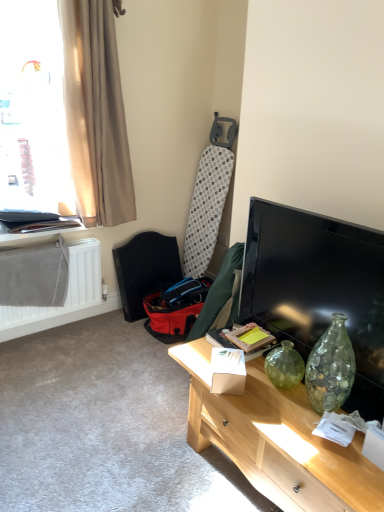
Question: Considering the relative sizes of matte black tv at right and matte black folder at upper left in the image provided, is matte black tv at right wider than matte black folder at upper left?

Choices:
 (A) yes
 (B) no

Answer: (B)

Question: Can you confirm if matte black tv at right is shorter than matte black folder at upper left?

Choices:
 (A) yes
 (B) no

Answer: (B)

Question: From a real-world perspective, does matte black tv at right sit lower than matte black folder at upper left?

Choices:
 (A) yes
 (B) no

Answer: (B)

Question: Is matte black tv at right oriented towards matte black folder at upper left?

Choices:
 (A) no
 (B) yes

Answer: (A)

Question: Can you confirm if matte black tv at right is thinner than matte black folder at upper left?

Choices:
 (A) yes
 (B) no

Answer: (A)

Question: From the image's perspective, is matte black tv at right below matte black folder at upper left?

Choices:
 (A) yes
 (B) no

Answer: (A)

Question: From the image's perspective, is red fabric swivel chair at lower left under matte black tv at right?

Choices:
 (A) yes
 (B) no

Answer: (B)

Question: Is red fabric swivel chair at lower left taller than matte black tv at right?

Choices:
 (A) yes
 (B) no

Answer: (A)

Question: Considering the relative sizes of red fabric swivel chair at lower left and matte black tv at right in the image provided, is red fabric swivel chair at lower left wider than matte black tv at right?

Choices:
 (A) no
 (B) yes

Answer: (B)

Question: From a real-world perspective, is red fabric swivel chair at lower left on matte black tv at right?

Choices:
 (A) yes
 (B) no

Answer: (B)

Question: Is red fabric swivel chair at lower left facing away from matte black tv at right?

Choices:
 (A) yes
 (B) no

Answer: (B)

Question: Considering the relative sizes of red fabric swivel chair at lower left and matte black tv at right in the image provided, is red fabric swivel chair at lower left bigger than matte black tv at right?

Choices:
 (A) yes
 (B) no

Answer: (A)

Question: Is red fabric swivel chair at lower left facing towards white matte radiator at lower left?

Choices:
 (A) yes
 (B) no

Answer: (B)